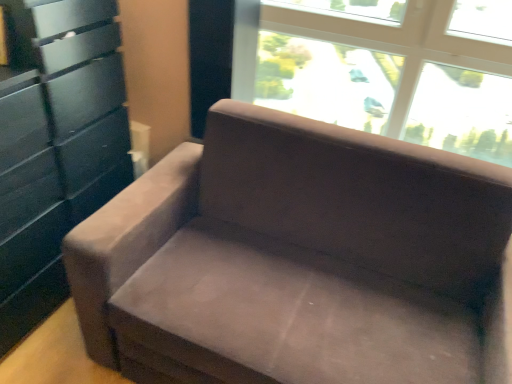
Question: Is transparent glass window at upper center outside matte black dresser at left?

Choices:
 (A) no
 (B) yes

Answer: (B)

Question: Does transparent glass window at upper center contain matte black dresser at left?

Choices:
 (A) yes
 (B) no

Answer: (B)

Question: Can you confirm if transparent glass window at upper center is positioned to the right of matte black dresser at left?

Choices:
 (A) no
 (B) yes

Answer: (B)

Question: From a real-world perspective, is transparent glass window at upper center beneath matte black dresser at left?

Choices:
 (A) yes
 (B) no

Answer: (B)

Question: Does transparent glass window at upper center turn towards matte black dresser at left?

Choices:
 (A) no
 (B) yes

Answer: (A)

Question: Based on their positions, is suede couch at center located to the left or right of matte black dresser at left?

Choices:
 (A) right
 (B) left

Answer: (A)

Question: Looking at the image, does suede couch at center seem bigger or smaller compared to matte black dresser at left?

Choices:
 (A) small
 (B) big

Answer: (B)

Question: Is point (378, 145) closer or farther from the camera than point (37, 21)?

Choices:
 (A) farther
 (B) closer

Answer: (A)

Question: From a real-world perspective, is suede couch at center positioned above or below matte black dresser at left?

Choices:
 (A) below
 (B) above

Answer: (A)

Question: Considering the positions of matte black dresser at left and transparent glass window at upper center in the image, is matte black dresser at left taller or shorter than transparent glass window at upper center?

Choices:
 (A) tall
 (B) short

Answer: (A)

Question: Is point (74, 168) closer or farther from the camera than point (338, 48)?

Choices:
 (A) closer
 (B) farther

Answer: (A)

Question: From a real-world perspective, is matte black dresser at left above or below transparent glass window at upper center?

Choices:
 (A) above
 (B) below

Answer: (B)

Question: In the image, is matte black dresser at left positioned in front of or behind transparent glass window at upper center?

Choices:
 (A) behind
 (B) front

Answer: (B)

Question: Would you say matte black dresser at left is to the left or to the right of suede couch at center in the picture?

Choices:
 (A) right
 (B) left

Answer: (B)

Question: Is point (31, 69) positioned closer to the camera than point (183, 329)?

Choices:
 (A) closer
 (B) farther

Answer: (B)